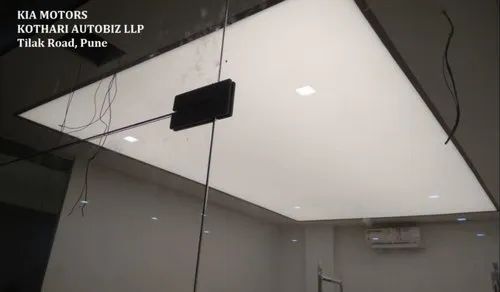
At what (x,y) coordinates should I click in order to perform the action: click on window panes. Please return your answer as a coordinate pair (x, y). Looking at the image, I should click on (172, 72), (136, 204), (321, 167).